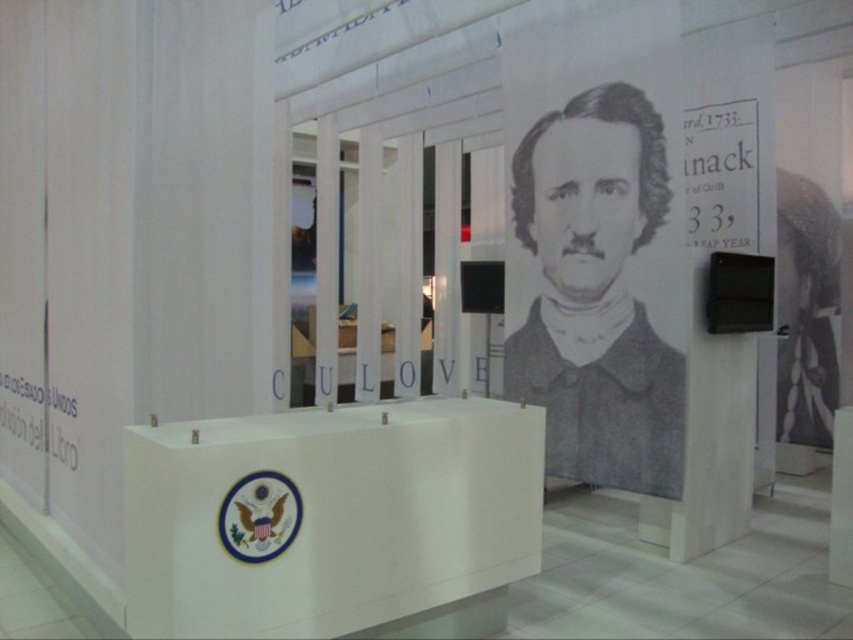
You are an art student standing in front of the white glossy podium at center and the gray pencil portrait at center. Which object is closer to you?

The white glossy podium at center is closer to you because it is in front of the gray pencil portrait at center.

You are standing in the museum and want to take a photo of the structure with both the point at coordinates point (254, 486) and point (621, 164) in the frame. Which point should you focus on to ensure both are in focus?

You should focus on point (621, 164) because it is farther from the camera than point (254, 486). By focusing on the farther point, both points will be within the depth of field and in focus.

You are a photographer standing at the camera position. You want to take a photo of the white glossy podium at center. Is the podium within your camera frame if the camera has a focal length of 50mm and a field of view of 46 degrees?

The white glossy podium at center and camera are 7.07 feet apart from each other. To determine if it fits in the camera frame with a 50mm focal length and 46 degree field of view, we can calculate the horizontal field of view width. Using the formula width at distance d is 2 x d x tan FOV angle over 2. Here, d is 7.07 feet, angle is 46 degrees. Calculating tan 23 degrees gives approximately 0.424. Multiplying 2 x 7.07 x 0.424 equals about 6.05 feet. Since the podium is at the center and the total field of 6